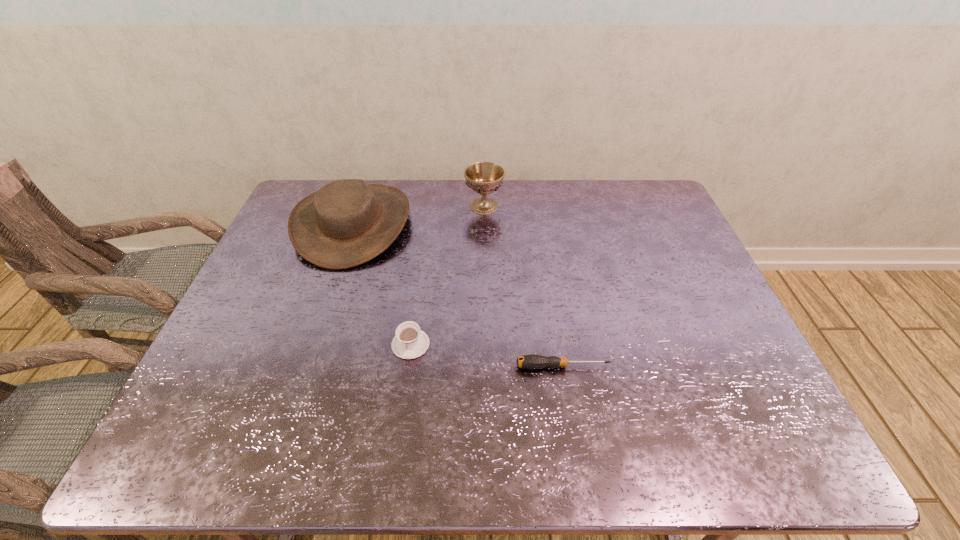
At what (x,y) coordinates should I click in order to perform the action: click on object that is the third closest to the chalice. Please return your answer as a coordinate pair (x, y). The image size is (960, 540). Looking at the image, I should click on pyautogui.click(x=532, y=361).

Locate an element on the screen. The height and width of the screenshot is (540, 960). vacant space that satisfies the following two spatial constraints: 1. on the handle side of the second nearest object; 2. on the left side of the screwdriver is located at coordinates (407, 366).

You are a GUI agent. You are given a task and a screenshot of the screen. Output one action in this format:
    pyautogui.click(x=<x>, y=<y>)
    Task: Click on the free point that satisfies the following two spatial constraints: 1. on the front side of the third object from left to right; 2. on the left side of the nearest object
    The image size is (960, 540).
    Given the screenshot: What is the action you would take?
    pyautogui.click(x=486, y=366)

Where is `free space that satisfies the following two spatial constraints: 1. on the handle side of the third farthest object; 2. on the right side of the nearest object`? free space that satisfies the following two spatial constraints: 1. on the handle side of the third farthest object; 2. on the right side of the nearest object is located at coordinates click(x=407, y=366).